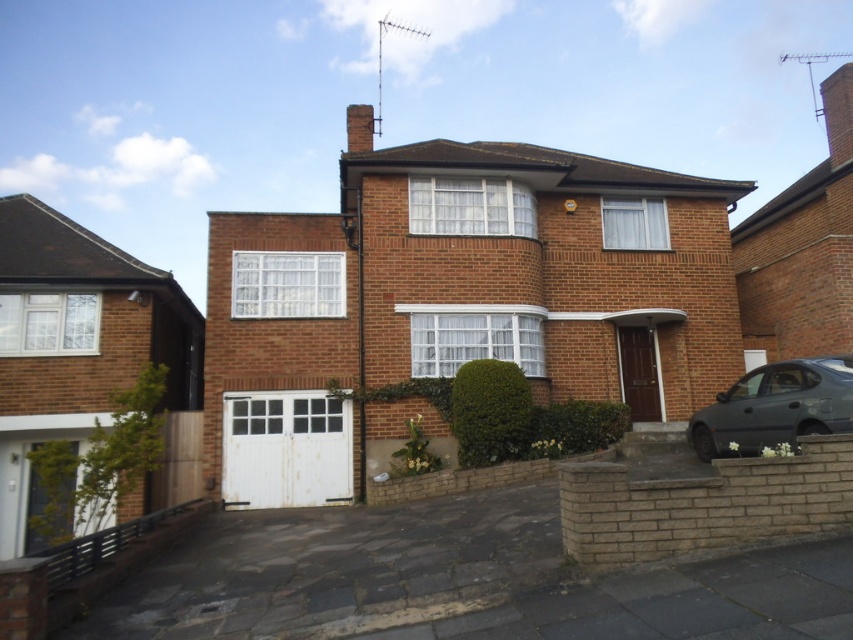
Describe the element at coordinates (285, 449) in the screenshot. I see `white painted wood garage door at lower center` at that location.

Who is taller, white painted wood garage door at lower center or dark gray metallic car at lower right?

white painted wood garage door at lower center is taller.

Is point (345, 454) positioned behind point (819, 410)?

Yes.

Image resolution: width=853 pixels, height=640 pixels. I want to click on white painted wood garage door at lower center, so [285, 449].